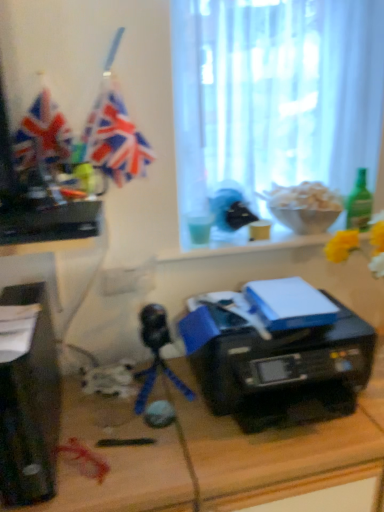
You are a GUI agent. You are given a task and a screenshot of the screen. Output one action in this format:
    pyautogui.click(x=<x>, y=<y>)
    Task: Click on the vacant space to the right of translucent plastic cup at window
    The image size is (384, 512).
    Given the screenshot: What is the action you would take?
    pyautogui.click(x=249, y=237)